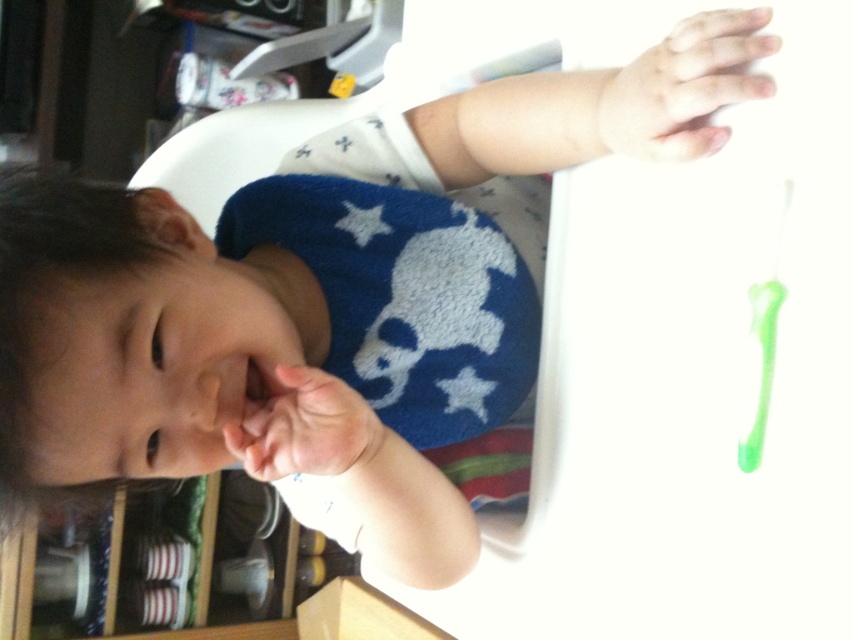
Based on the scene described, where is the smooth skin hand at upper right located in terms of coordinates?

The smooth skin hand at upper right is located at coordinates point (685, 86).

You are a parent observing your child in the high chair. You notice a hand at point [685,86]. Which hand is it? The child has a hand raised with fingers slightly spread and another hand near their mouth. Please identify which hand is at that coordinate.

The smooth skin hand at upper right is located at point [685,86], so the hand at that coordinate is the child s right hand since it s the one raised with fingers slightly spread.

You are a parent trying to ensure your child doesn not choke on small objects. You see the smooth skin hand at upper right and the pink soft skin at center. Which object is closer to the child to monitor?

The smooth skin hand at upper right is closer to the viewer than the pink soft skin at center, so the smooth skin hand at upper right is closer to the child and should be monitored.